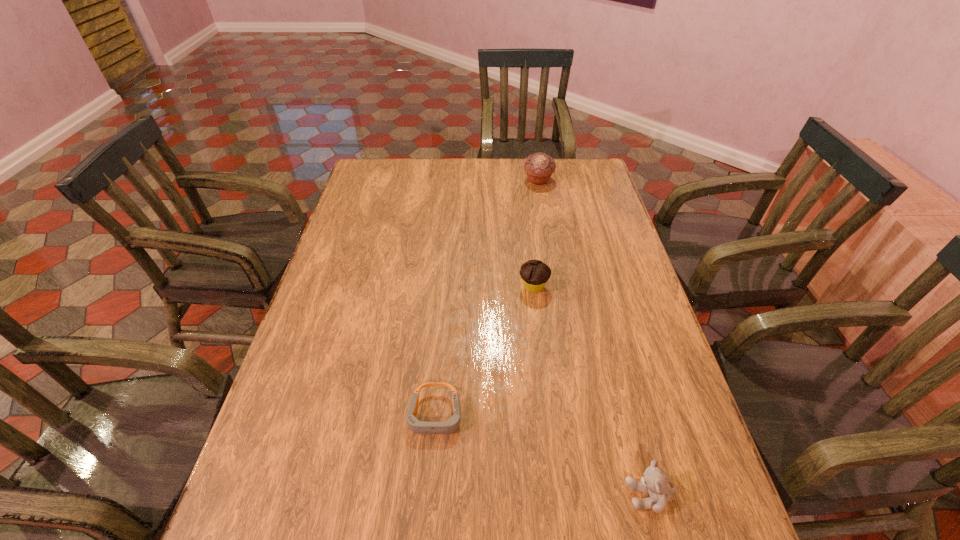
This screenshot has height=540, width=960. I want to click on vacant area that lies between the goggles and the rightmost object, so click(542, 455).

The image size is (960, 540). Identify the location of empty space between the farthest object and the second nearest object. (487, 298).

Where is `empty space between the goggles and the second farthest object`? The image size is (960, 540). empty space between the goggles and the second farthest object is located at coordinates (485, 351).

The image size is (960, 540). I want to click on free space between the shortest object and the farther muffin, so click(487, 298).

I want to click on vacant point located between the taller muffin and the nearest object, so click(594, 338).

Find the location of a particular element. The image size is (960, 540). free space between the farthest object and the third farthest object is located at coordinates [x=487, y=298].

Identify the location of free spot between the third farthest object and the farthest object. The height and width of the screenshot is (540, 960). (487, 298).

Where is `vacant space that is in between the shortest object and the rightmost object`? The image size is (960, 540). vacant space that is in between the shortest object and the rightmost object is located at coordinates (542, 455).

This screenshot has height=540, width=960. Identify the location of free spot between the nearest object and the shorter muffin. (591, 391).

Identify the location of object that is the second closest to the nearer muffin. Image resolution: width=960 pixels, height=540 pixels. (539, 167).